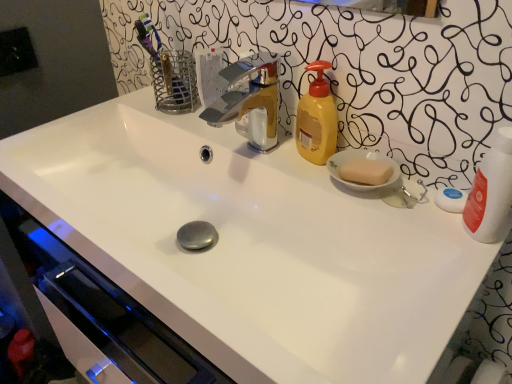
Question: Is yellow matte soap dispenser at upper right closer to camera compared to white glossy bottle at right?

Choices:
 (A) no
 (B) yes

Answer: (A)

Question: From a real-world perspective, is yellow matte soap dispenser at upper right under white glossy bottle at right?

Choices:
 (A) no
 (B) yes

Answer: (B)

Question: Are yellow matte soap dispenser at upper right and white glossy bottle at right located far from each other?

Choices:
 (A) yes
 (B) no

Answer: (B)

Question: Does yellow matte soap dispenser at upper right appear on the left side of white glossy bottle at right?

Choices:
 (A) no
 (B) yes

Answer: (B)

Question: Does yellow matte soap dispenser at upper right appear on the right side of white glossy bottle at right?

Choices:
 (A) yes
 (B) no

Answer: (B)

Question: Considering the relative sizes of yellow matte soap dispenser at upper right and white glossy bottle at right in the image provided, is yellow matte soap dispenser at upper right shorter than white glossy bottle at right?

Choices:
 (A) yes
 (B) no

Answer: (A)

Question: From a real-world perspective, is polished chrome faucet at center on yellow matte soap dispenser at upper right?

Choices:
 (A) no
 (B) yes

Answer: (B)

Question: Is polished chrome faucet at center positioned in front of yellow matte soap dispenser at upper right?

Choices:
 (A) no
 (B) yes

Answer: (B)

Question: Considering the relative sizes of polished chrome faucet at center and yellow matte soap dispenser at upper right in the image provided, is polished chrome faucet at center bigger than yellow matte soap dispenser at upper right?

Choices:
 (A) no
 (B) yes

Answer: (B)

Question: Can you confirm if polished chrome faucet at center is taller than yellow matte soap dispenser at upper right?

Choices:
 (A) no
 (B) yes

Answer: (A)

Question: Does polished chrome faucet at center have a greater width compared to yellow matte soap dispenser at upper right?

Choices:
 (A) no
 (B) yes

Answer: (B)

Question: Is polished chrome faucet at center directly adjacent to yellow matte soap dispenser at upper right?

Choices:
 (A) yes
 (B) no

Answer: (B)

Question: From a real-world perspective, is yellow matte soap dispenser at upper right located higher than polished chrome faucet at center?

Choices:
 (A) yes
 (B) no

Answer: (B)